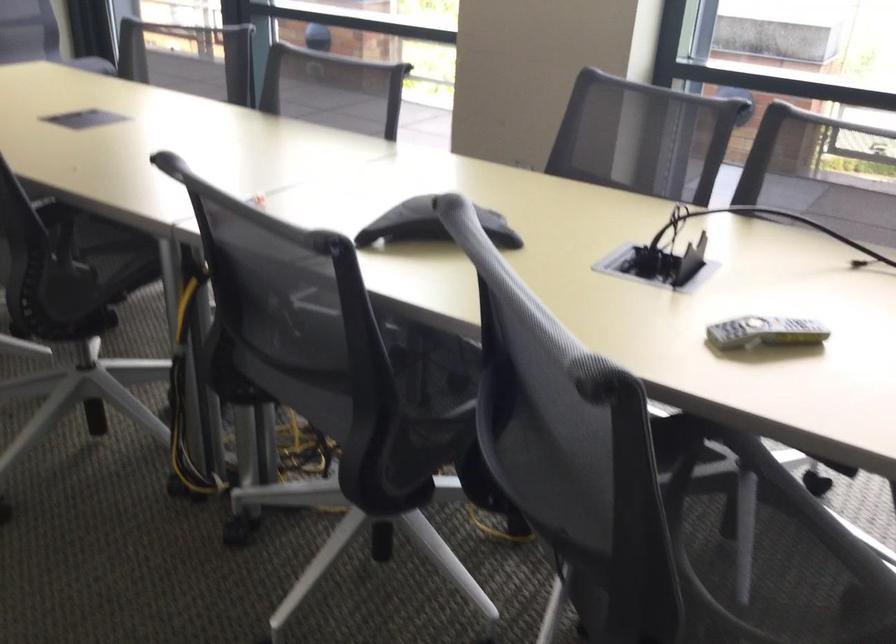
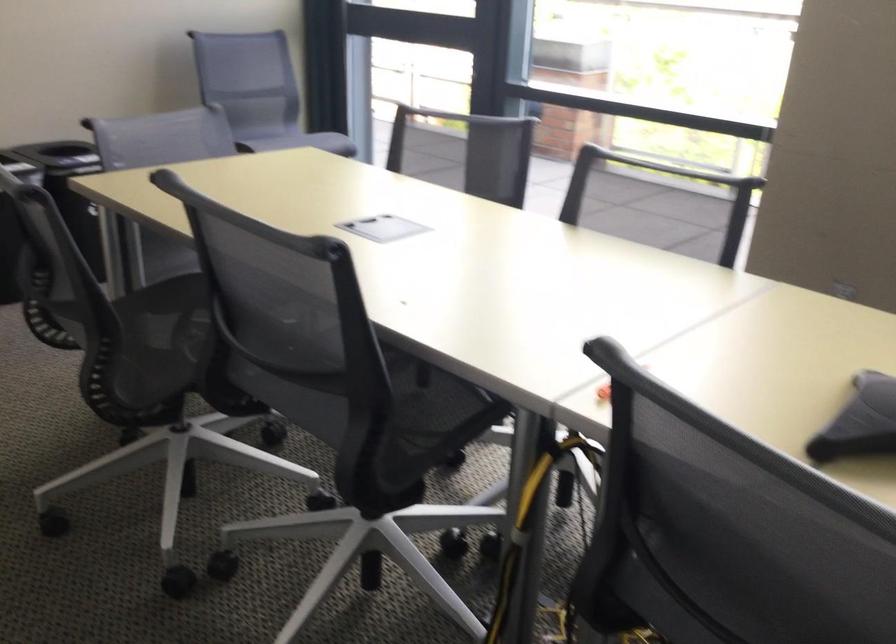
Which direction would the cameraman need to move to produce the second image?

The cameraman walked toward left, forward.